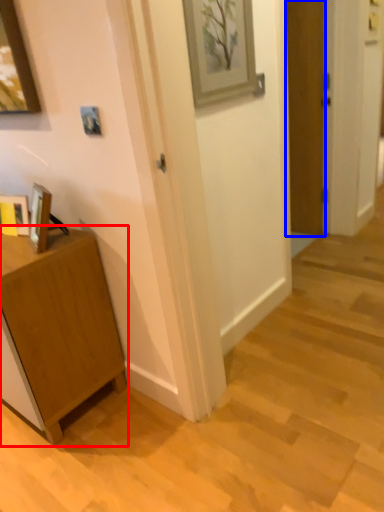
Question: Which point is closer to the camera, cabinetry (highlighted by a red box) or door (highlighted by a blue box)?

Choices:
 (A) cabinetry
 (B) door

Answer: (A)